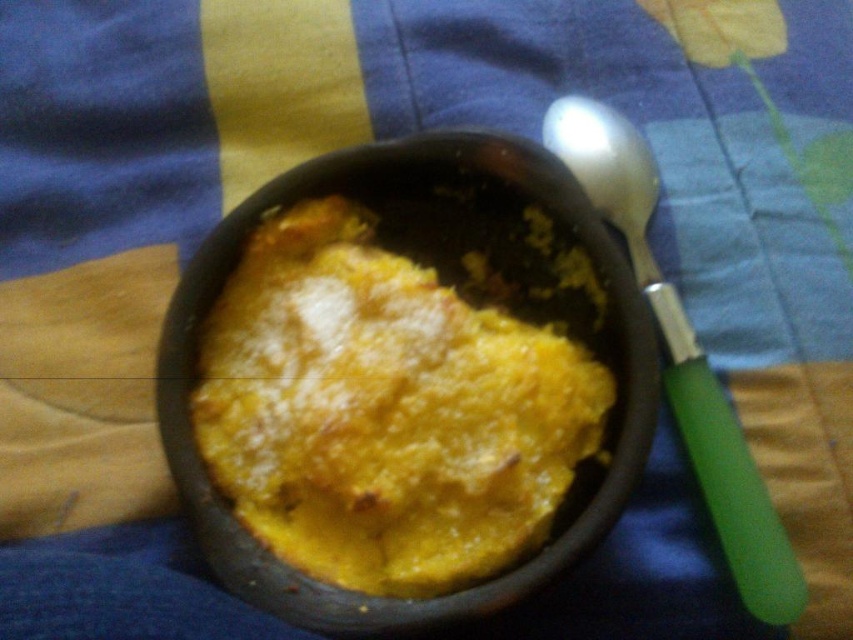
Question: Can you confirm if yellow matte cake at center is bigger than green plastic spoon at right?

Choices:
 (A) no
 (B) yes

Answer: (A)

Question: Which point is farther to the camera?

Choices:
 (A) 547,131
 (B) 596,420

Answer: (A)

Question: Is yellow matte cake at center bigger than green plastic spoon at right?

Choices:
 (A) no
 (B) yes

Answer: (A)

Question: Which object is farther from the camera taking this photo?

Choices:
 (A) green plastic spoon at right
 (B) yellow matte cake at center

Answer: (B)

Question: Is yellow matte cake at center below green plastic spoon at right?

Choices:
 (A) no
 (B) yes

Answer: (B)

Question: Among these objects, which one is farthest from the camera?

Choices:
 (A) green plastic spoon at right
 (B) yellow matte cake at center

Answer: (B)